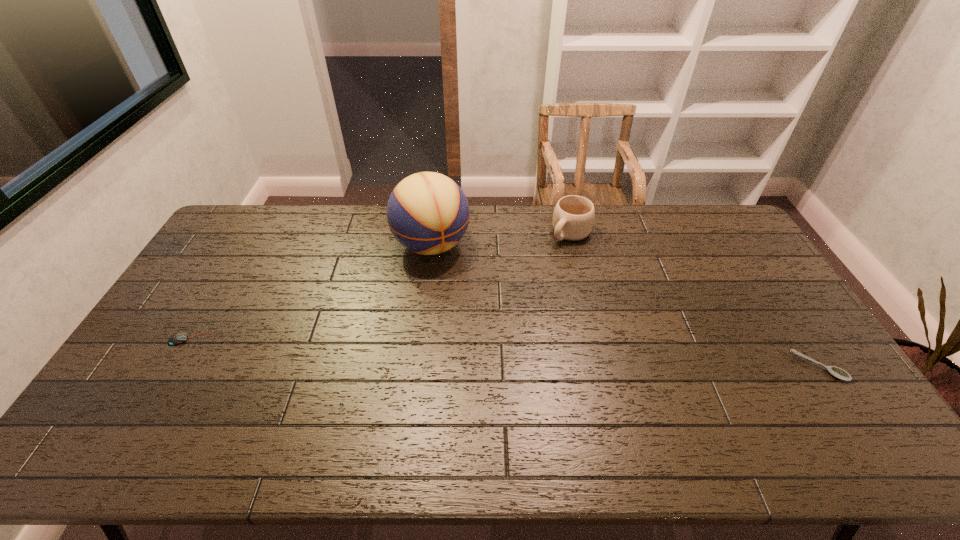
The height and width of the screenshot is (540, 960). What are the coordinates of `free spot between the mouse and the second object from right to left` in the screenshot? It's located at (381, 286).

The image size is (960, 540). What are the coordinates of `free space between the basketball and the soupspoon` in the screenshot? It's located at (625, 306).

The width and height of the screenshot is (960, 540). In order to click on blank region between the third farthest object and the rightmost object in this screenshot , I will do `click(505, 353)`.

Where is `vacant space that is in between the third object from left to right and the tallest object`? This screenshot has height=540, width=960. vacant space that is in between the third object from left to right and the tallest object is located at coordinates (501, 239).

This screenshot has height=540, width=960. What are the coordinates of `free space between the rightmost object and the mouse` in the screenshot? It's located at (505, 353).

Choose which object is the second nearest neighbor to the mouse. Please provide its 2D coordinates. Your answer should be formatted as a tuple, i.e. [(x, y)], where the tuple contains the x and y coordinates of a point satisfying the conditions above.

[(573, 218)]

Point out which object is positioned as the second nearest to the tallest object. Please provide its 2D coordinates. Your answer should be formatted as a tuple, i.e. [(x, y)], where the tuple contains the x and y coordinates of a point satisfying the conditions above.

[(178, 338)]

At what (x,y) coordinates should I click in order to perform the action: click on blank space that satisfies the following two spatial constraints: 1. on the back side of the second tallest object; 2. on the left side of the third object from right to left. Please return your answer as a coordinate pair (x, y). Image resolution: width=960 pixels, height=540 pixels. Looking at the image, I should click on (433, 232).